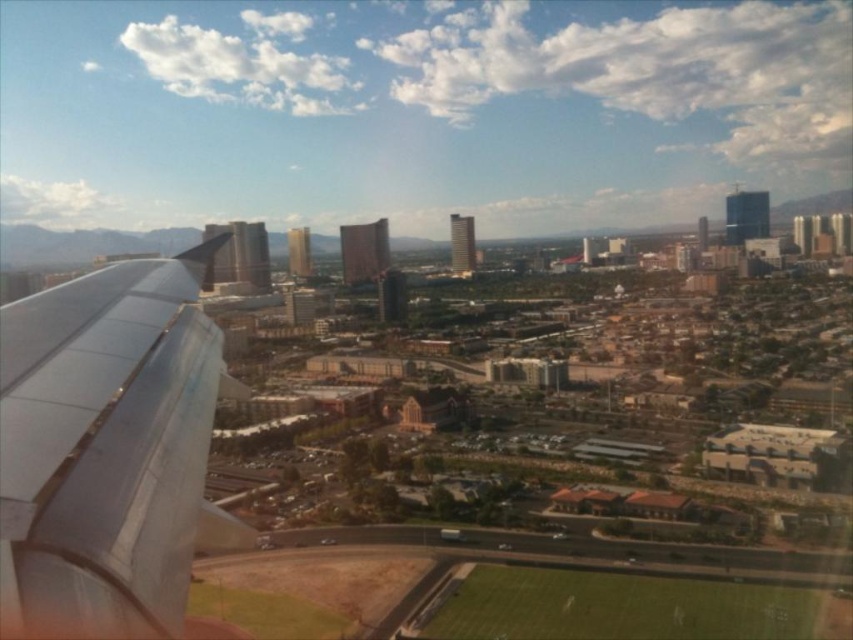
Is metallic gray wing at left smaller than green grass football field at lower center?

No.

Is the position of metallic gray wing at left more distant than that of green grass football field at lower center?

That is False.

This screenshot has width=853, height=640. What do you see at coordinates (106, 442) in the screenshot? I see `metallic gray wing at left` at bounding box center [106, 442].

Where is `metallic gray wing at left`? Image resolution: width=853 pixels, height=640 pixels. metallic gray wing at left is located at coordinates (106, 442).